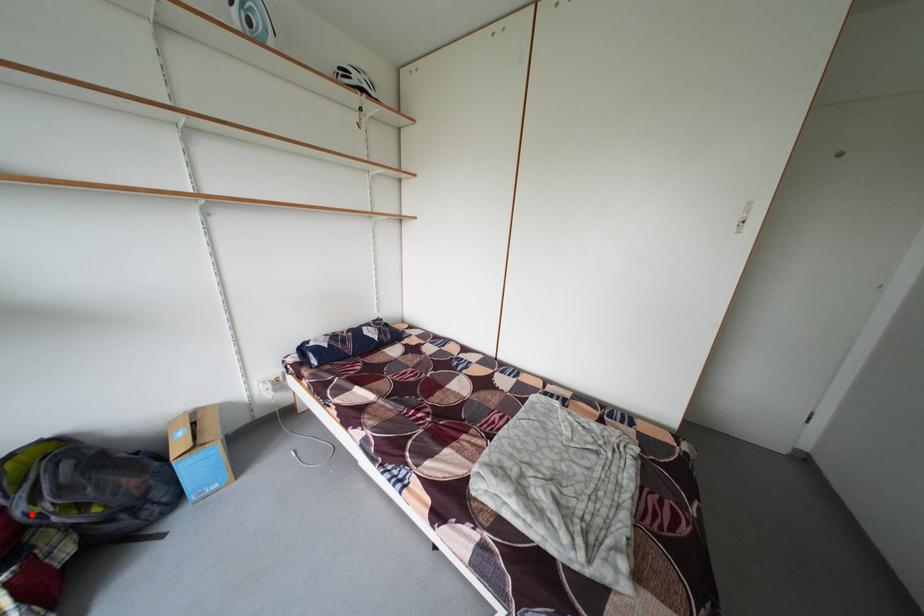
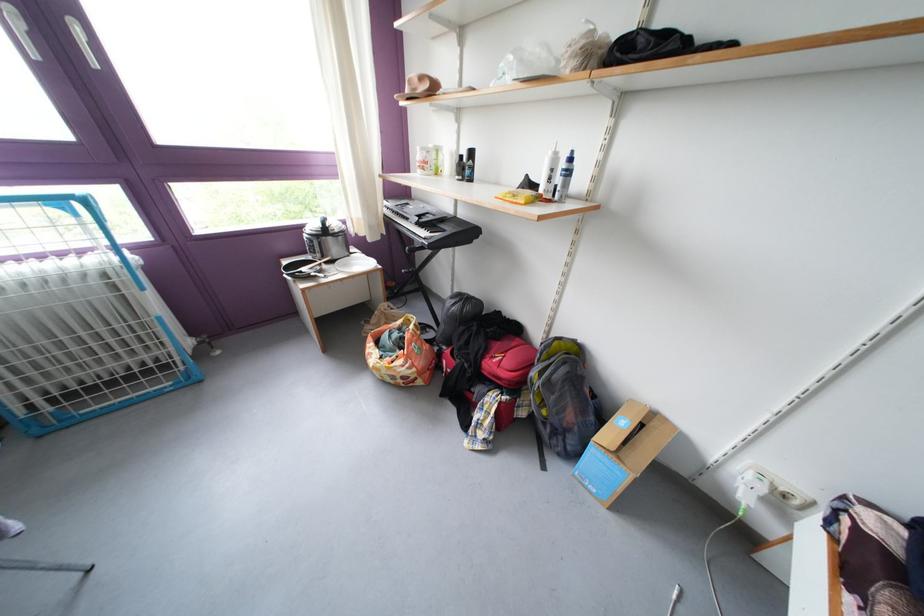
In the second image, find the point that corresponds to the highlighted location in the first image.

(543, 379)